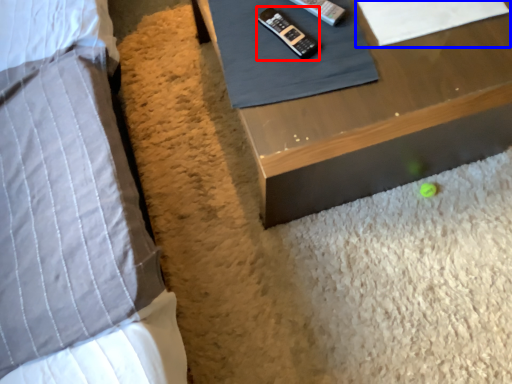
Question: Which object appears farthest to the camera in this image, control (highlighted by a red box) or sheet (highlighted by a blue box)?

Choices:
 (A) control
 (B) sheet

Answer: (B)